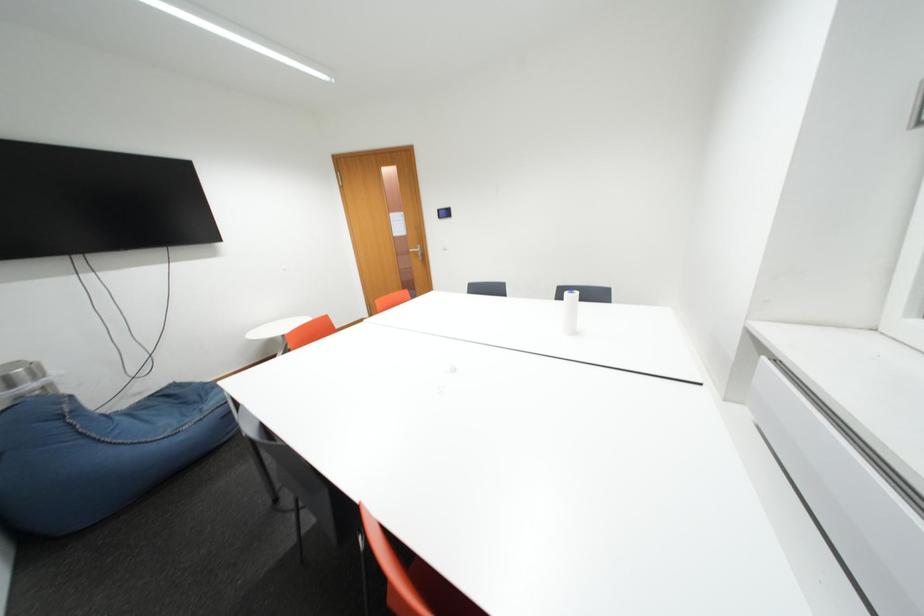
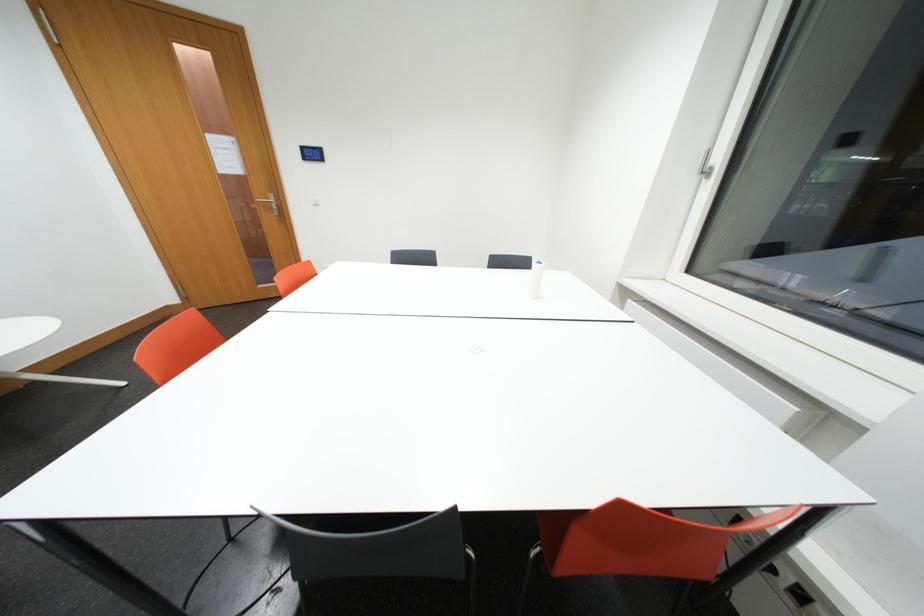
Question: How did the camera likely rotate?

Choices:
 (A) Left
 (B) Right
 (C) Up
 (D) Down

Answer: (B)